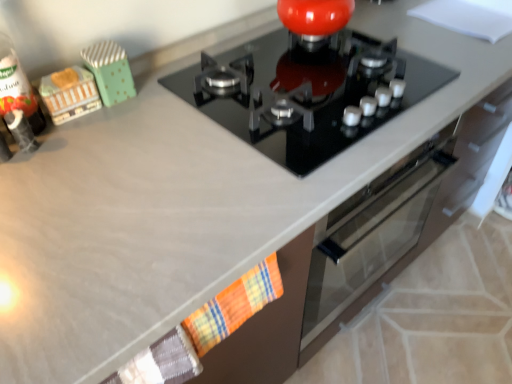
From the picture: What is the approximate width of green polka dot fabric at upper left, arranged as the second toy when viewed from the left?

The width of green polka dot fabric at upper left, arranged as the second toy when viewed from the left, is 4.84 inches.

At what (x,y) coordinates should I click in order to perform the action: click on black glass gas stove at center. Please return your answer as a coordinate pair (x, y). Looking at the image, I should click on (307, 92).

What are the coordinates of `green polka dot fabric at upper left, the 1th toy in the right-to-left sequence` in the screenshot? It's located at (110, 71).

Consider the image. In terms of height, does wooden toy train at left, the 1th toy positioned from the left, look taller or shorter compared to green polka dot fabric at upper left, the 1th toy in the right-to-left sequence?

wooden toy train at left, the 1th toy positioned from the left, is shorter than green polka dot fabric at upper left, the 1th toy in the right-to-left sequence.

Is wooden toy train at left, marked as the second toy in a right-to-left arrangement, inside the boundaries of green polka dot fabric at upper left, arranged as the second toy when viewed from the left, or outside?

wooden toy train at left, marked as the second toy in a right-to-left arrangement, is not inside green polka dot fabric at upper left, arranged as the second toy when viewed from the left, it's outside.

Can you confirm if wooden toy train at left, the 1th toy positioned from the left, is positioned to the left of green polka dot fabric at upper left, the 1th toy in the right-to-left sequence?

Correct, you'll find wooden toy train at left, the 1th toy positioned from the left, to the left of green polka dot fabric at upper left, the 1th toy in the right-to-left sequence.

Who is smaller, wooden toy train at left, marked as the second toy in a right-to-left arrangement, or green polka dot fabric at upper left, arranged as the second toy when viewed from the left?

wooden toy train at left, marked as the second toy in a right-to-left arrangement.

Is wooden toy train at left, marked as the second toy in a right-to-left arrangement, facing towards black glass gas stove at center?

No, wooden toy train at left, marked as the second toy in a right-to-left arrangement, is not facing towards black glass gas stove at center.

Which object is positioned more to the left, wooden toy train at left, the 1th toy positioned from the left, or black glass gas stove at center?

wooden toy train at left, the 1th toy positioned from the left, is more to the left.

From a real-world perspective, is wooden toy train at left, marked as the second toy in a right-to-left arrangement, positioned above or below black glass gas stove at center?

Clearly, from a real-world perspective, wooden toy train at left, marked as the second toy in a right-to-left arrangement, is above black glass gas stove at center.

Which object is thinner, wooden toy train at left, marked as the second toy in a right-to-left arrangement, or black glass gas stove at center?

Thinner between the two is wooden toy train at left, marked as the second toy in a right-to-left arrangement.

From a real-world perspective, which object rests below the other?

plaid fabric hand towel at lower center.

Considering the relative positions of black glass gas stove at center and plaid fabric hand towel at lower center in the image provided, is black glass gas stove at center to the left of plaid fabric hand towel at lower center from the viewer's perspective?

No, black glass gas stove at center is not to the left of plaid fabric hand towel at lower center.

Between black glass gas stove at center and plaid fabric hand towel at lower center, which one has smaller size?

With smaller size is plaid fabric hand towel at lower center.

Is black glass gas stove at center aimed at plaid fabric hand towel at lower center?

No, black glass gas stove at center does not turn towards plaid fabric hand towel at lower center.

Considering the relative sizes of plaid fabric hand towel at lower center and green polka dot fabric at upper left, arranged as the second toy when viewed from the left, in the image provided, is plaid fabric hand towel at lower center thinner than green polka dot fabric at upper left, arranged as the second toy when viewed from the left,?

Yes, plaid fabric hand towel at lower center is thinner than green polka dot fabric at upper left, arranged as the second toy when viewed from the left.

From a real-world perspective, is plaid fabric hand towel at lower center below green polka dot fabric at upper left, the 1th toy in the right-to-left sequence?

Yes, from a real-world perspective, plaid fabric hand towel at lower center is beneath green polka dot fabric at upper left, the 1th toy in the right-to-left sequence.

From their relative heights in the image, would you say plaid fabric hand towel at lower center is taller or shorter than green polka dot fabric at upper left, the 1th toy in the right-to-left sequence?

In the image, plaid fabric hand towel at lower center appears to be shorter than green polka dot fabric at upper left, the 1th toy in the right-to-left sequence.

Is plaid fabric hand towel at lower center to the left or to the right of green polka dot fabric at upper left, arranged as the second toy when viewed from the left, in the image?

In the image, plaid fabric hand towel at lower center appears on the right side of green polka dot fabric at upper left, arranged as the second toy when viewed from the left.

Which object is more forward, green polka dot fabric at upper left, arranged as the second toy when viewed from the left, or plaid fabric hand towel at lower center?

plaid fabric hand towel at lower center is closer to the camera.

How different are the orientations of green polka dot fabric at upper left, the 1th toy in the right-to-left sequence, and plaid fabric hand towel at lower center in degrees?

green polka dot fabric at upper left, the 1th toy in the right-to-left sequence, and plaid fabric hand towel at lower center are facing 2.66 degrees away from each other.

Is green polka dot fabric at upper left, arranged as the second toy when viewed from the left, thinner than plaid fabric hand towel at lower center?

Incorrect, the width of green polka dot fabric at upper left, arranged as the second toy when viewed from the left, is not less than that of plaid fabric hand towel at lower center.

Between green polka dot fabric at upper left, arranged as the second toy when viewed from the left, and plaid fabric hand towel at lower center, which one appears on the left side from the viewer's perspective?

green polka dot fabric at upper left, arranged as the second toy when viewed from the left.

From the image's perspective, who appears lower, black glass gas stove at center or wooden toy train at left, the 1th toy positioned from the left?

wooden toy train at left, the 1th toy positioned from the left, is shown below in the image.

Which of these two, black glass gas stove at center or wooden toy train at left, the 1th toy positioned from the left, stands taller?

wooden toy train at left, the 1th toy positioned from the left, is taller.

Looking at this image, what's the angular difference between black glass gas stove at center and wooden toy train at left, the 1th toy positioned from the left,'s facing directions?

black glass gas stove at center and wooden toy train at left, the 1th toy positioned from the left, are facing 2.62 degrees away from each other.

Between black glass gas stove at center and wooden toy train at left, the 1th toy positioned from the left, which one has larger width?

black glass gas stove at center.

Considering the relative positions of plaid fabric hand towel at lower center and black glass gas stove at center in the image provided, is plaid fabric hand towel at lower center to the right of black glass gas stove at center from the viewer's perspective?

No, plaid fabric hand towel at lower center is not to the right of black glass gas stove at center.

Which object is more forward, plaid fabric hand towel at lower center or black glass gas stove at center?

plaid fabric hand towel at lower center is in front.

Looking at the image, does plaid fabric hand towel at lower center seem bigger or smaller compared to black glass gas stove at center?

plaid fabric hand towel at lower center is smaller than black glass gas stove at center.

From the picture: From the image's perspective, does plaid fabric hand towel at lower center appear lower than black glass gas stove at center?

Yes.

The width and height of the screenshot is (512, 384). What are the coordinates of `toy below the green polka dot fabric at upper left, the 1th toy in the right-to-left sequence (from the image's perspective)` in the screenshot? It's located at (69, 94).

In order to click on gas stove in front of the wooden toy train at left, the 1th toy positioned from the left in this screenshot , I will do `click(307, 92)`.

Estimate the real-world distances between objects in this image. Which object is closer to green polka dot fabric at upper left, the 1th toy in the right-to-left sequence, plaid fabric hand towel at lower center or black glass gas stove at center?

black glass gas stove at center lies closer to green polka dot fabric at upper left, the 1th toy in the right-to-left sequence, than the other object.

Which object lies further to the anchor point black glass gas stove at center, wooden toy train at left, marked as the second toy in a right-to-left arrangement, or green polka dot fabric at upper left, arranged as the second toy when viewed from the left?

Based on the image, wooden toy train at left, marked as the second toy in a right-to-left arrangement, appears to be further to black glass gas stove at center.

Which object lies nearer to the anchor point black glass gas stove at center, green polka dot fabric at upper left, arranged as the second toy when viewed from the left, or plaid fabric hand towel at lower center?

Based on the image, green polka dot fabric at upper left, arranged as the second toy when viewed from the left, appears to be nearer to black glass gas stove at center.

Based on the photo, considering their positions, is wooden toy train at left, the 1th toy positioned from the left, positioned closer to green polka dot fabric at upper left, the 1th toy in the right-to-left sequence, than black glass gas stove at center?

wooden toy train at left, the 1th toy positioned from the left, is closer to green polka dot fabric at upper left, the 1th toy in the right-to-left sequence.

Estimate the real-world distances between objects in this image. Which object is closer to plaid fabric hand towel at lower center, green polka dot fabric at upper left, arranged as the second toy when viewed from the left, or black glass gas stove at center?

The object closer to plaid fabric hand towel at lower center is black glass gas stove at center.

Looking at the image, which one is located further to wooden toy train at left, marked as the second toy in a right-to-left arrangement, plaid fabric hand towel at lower center or black glass gas stove at center?

Based on the image, plaid fabric hand towel at lower center appears to be further to wooden toy train at left, marked as the second toy in a right-to-left arrangement.

In the scene shown: When comparing their distances from plaid fabric hand towel at lower center, does wooden toy train at left, marked as the second toy in a right-to-left arrangement, or black glass gas stove at center seem further?

wooden toy train at left, marked as the second toy in a right-to-left arrangement, lies further to plaid fabric hand towel at lower center than the other object.

From the image, which object appears to be farther from black glass gas stove at center, plaid fabric hand towel at lower center or green polka dot fabric at upper left, the 1th toy in the right-to-left sequence?

Based on the image, plaid fabric hand towel at lower center appears to be further to black glass gas stove at center.

You are a GUI agent. You are given a task and a screenshot of the screen. Output one action in this format:
    pyautogui.click(x=<x>, y=<y>)
    Task: Click on the toy between green polka dot fabric at upper left, arranged as the second toy when viewed from the left, and plaid fabric hand towel at lower center from top to bottom
    This screenshot has width=512, height=384.
    Given the screenshot: What is the action you would take?
    pyautogui.click(x=69, y=94)

You are a GUI agent. You are given a task and a screenshot of the screen. Output one action in this format:
    pyautogui.click(x=<x>, y=<y>)
    Task: Click on the hand towel between wooden toy train at left, the 1th toy positioned from the left, and black glass gas stove at center, in the horizontal direction
    
    Given the screenshot: What is the action you would take?
    pyautogui.click(x=234, y=305)

At what (x,y) coordinates should I click in order to perform the action: click on toy between wooden toy train at left, the 1th toy positioned from the left, and black glass gas stove at center, in the horizontal direction. Please return your answer as a coordinate pair (x, y). Looking at the image, I should click on (110, 71).